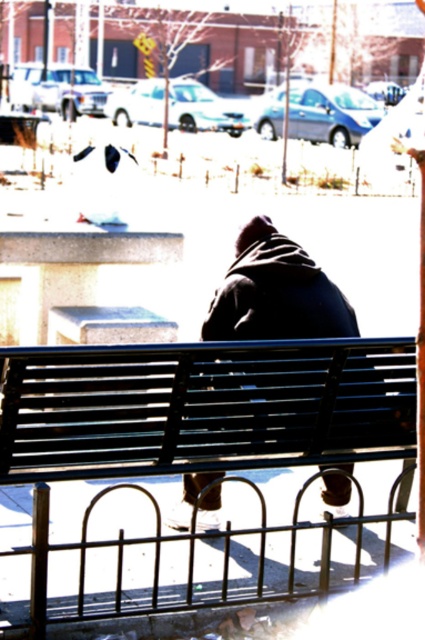
Question: Is black metal bench at center smaller than dark blue jacket at center?

Choices:
 (A) yes
 (B) no

Answer: (B)

Question: Which point is farther to the camera?

Choices:
 (A) (292, 464)
 (B) (292, 243)

Answer: (B)

Question: Does black metal bench at center appear under dark blue jacket at center?

Choices:
 (A) yes
 (B) no

Answer: (A)

Question: Does black metal bench at center appear on the left side of dark blue jacket at center?

Choices:
 (A) yes
 (B) no

Answer: (A)